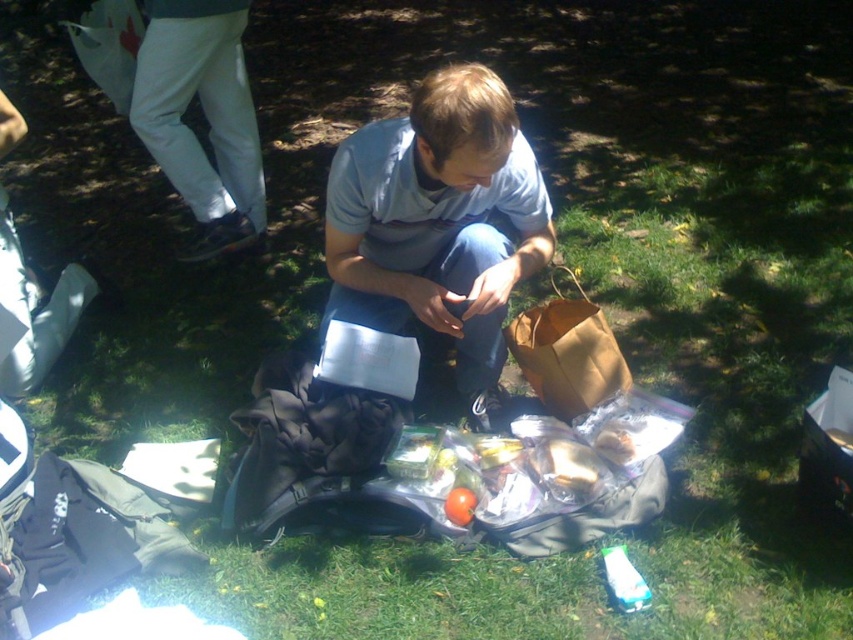
From the picture: You are organizing a small outdoor event and need to place a matte gray shirt at center and a brown paper bag at center on a table. If the table has limited space, which item should you prioritize placing first to ensure both fit?

The brown paper bag at center is smaller than the matte gray shirt at center. Therefore, you should place the matte gray shirt at center first to accommodate its larger size, then fit the brown paper bag at center around it.

You are organizing a picnic and need to place the brown paper bag at center and the shiny plastic container at center in your basket. According to the scene, which item is positioned higher when they are both placed in the basket?

The brown paper bag at center is located above the shiny plastic container at center in the scene, so when placing them in the basket, the brown paper bag at center would be positioned higher.